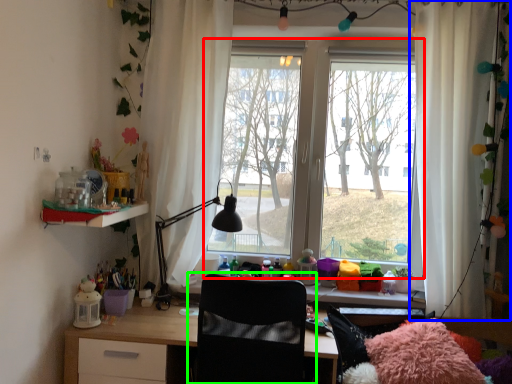
Question: Estimate the real-world distances between objects in this image. Which object is closer to window (highlighted by a red box), curtain (highlighted by a blue box) or chair (highlighted by a green box)?

Choices:
 (A) curtain
 (B) chair

Answer: (A)